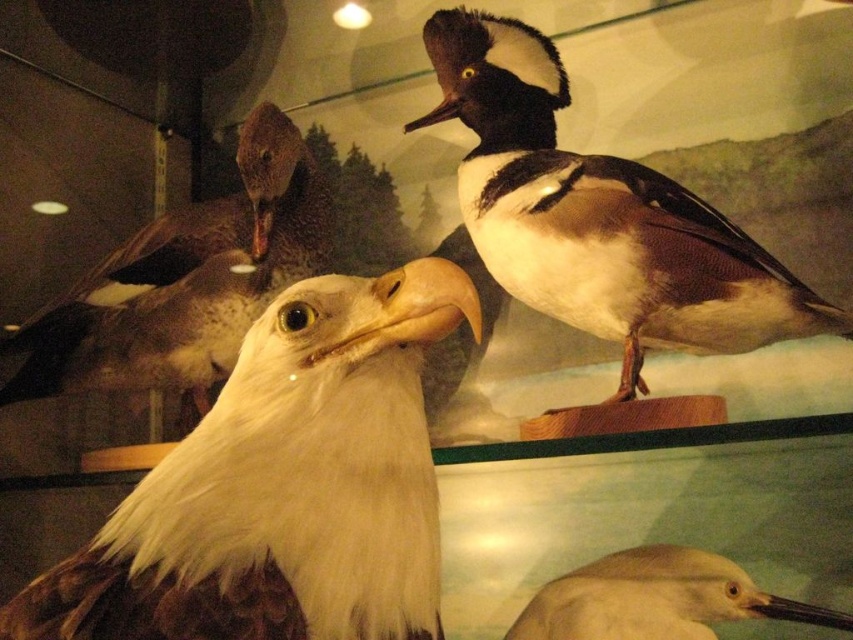
You are standing at the camera position and want to reach the point marked as point (x=508, y=134). Can you walk directly to it without moving any objects?

The distance between you and point (x=508, y=134) is 1.20 meters, so yes, you can walk directly to it without moving any objects as there is enough space.